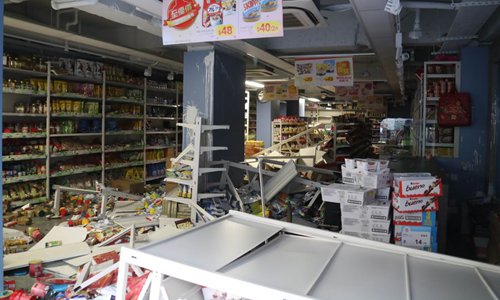
Image resolution: width=500 pixels, height=300 pixels. In order to click on red box on wall in this screenshot , I will do `click(455, 117)`.